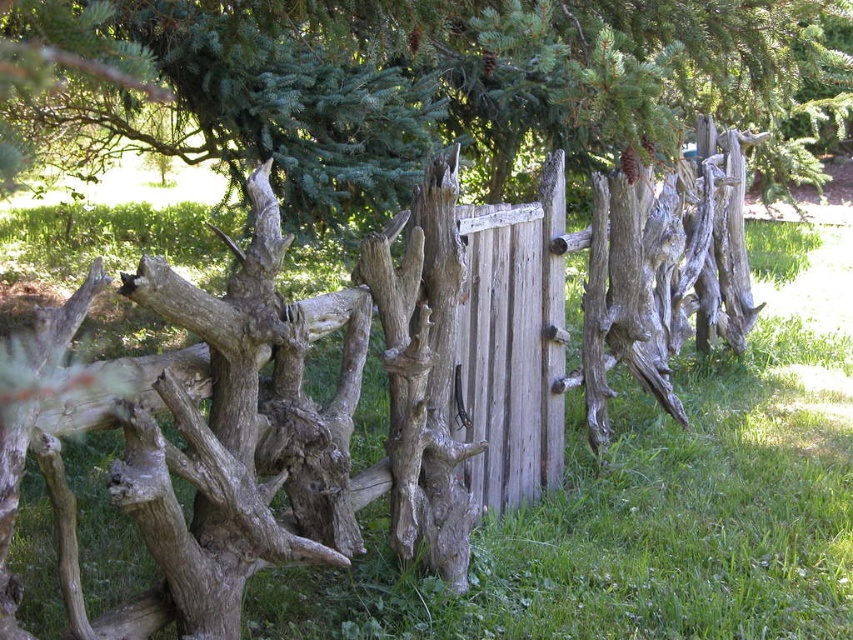
Question: Where is natural wood fence at center located in relation to green textured pine tree at upper center in the image?

Choices:
 (A) above
 (B) below

Answer: (B)

Question: Which point is closer to the camera taking this photo?

Choices:
 (A) (521, 428)
 (B) (730, 42)

Answer: (B)

Question: Is natural wood fence at center positioned before green textured pine tree at upper center?

Choices:
 (A) no
 (B) yes

Answer: (B)

Question: Among these objects, which one is farthest from the camera?

Choices:
 (A) green textured pine tree at upper center
 (B) natural wood fence at center

Answer: (A)

Question: Does natural wood fence at center have a greater width compared to green textured pine tree at upper center?

Choices:
 (A) yes
 (B) no

Answer: (B)